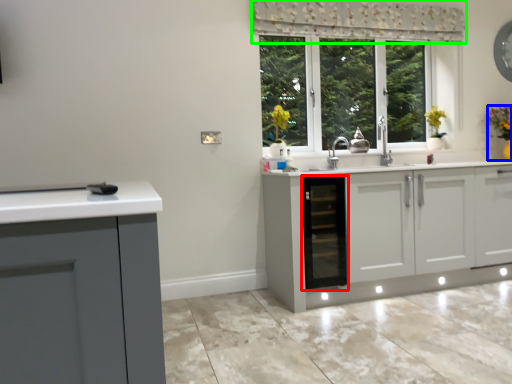
Question: Which is farther away from dish washer (highlighted by a red box)? houseplant (highlighted by a blue box) or curtain (highlighted by a green box)?

Choices:
 (A) houseplant
 (B) curtain

Answer: (A)